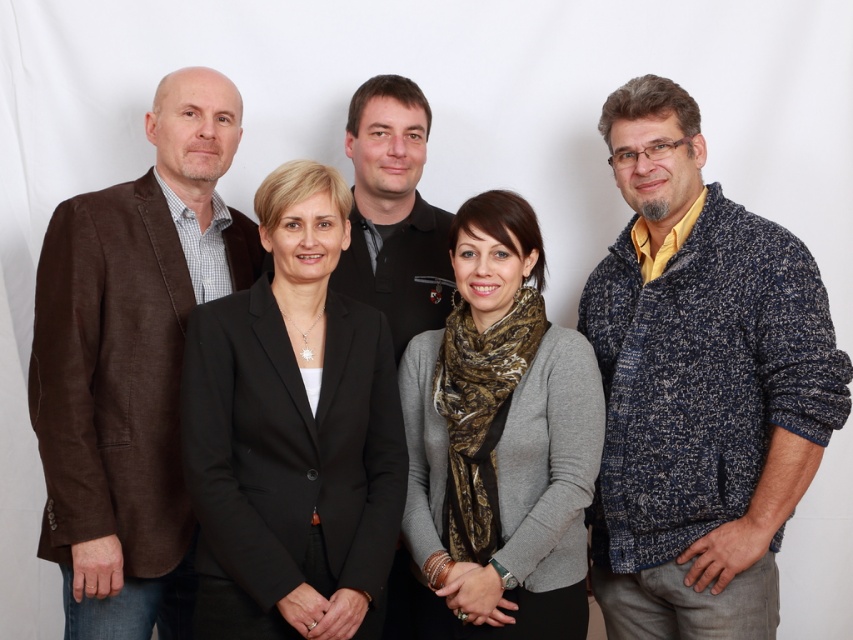
Is knitted blue sweater at right below brown linen blazer at left?

No, knitted blue sweater at right is not below brown linen blazer at left.

Consider the image. Does knitted blue sweater at right have a lesser width compared to brown linen blazer at left?

No.

Is point (750, 330) more distant than point (84, 572)?

No, it is in front of (84, 572).

Identify the location of knitted blue sweater at right. This screenshot has height=640, width=853. (699, 387).

Who is more forward, (x=509, y=572) or (x=386, y=186)?

Point (x=509, y=572) is more forward.

Where is `gray textured scarf at center`? gray textured scarf at center is located at coordinates (500, 438).

Who is higher up, black matte blazer at center or black matte shirt at center?

black matte shirt at center is above.

Is point (228, 376) less distant than point (424, 221)?

Yes, it is in front of point (424, 221).

Identify the location of black matte blazer at center. Image resolution: width=853 pixels, height=640 pixels. (292, 433).